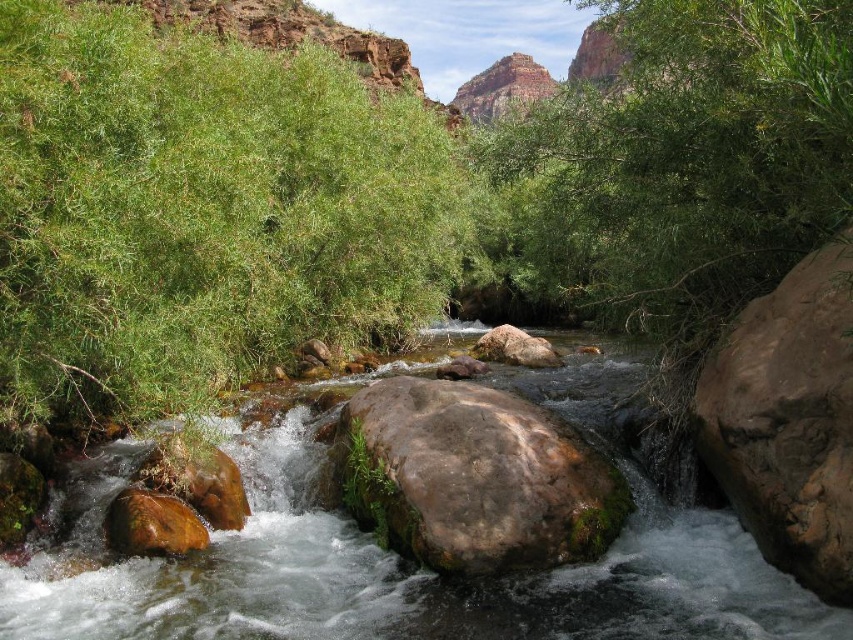
Which is below, green mossy rock at center or brown rough rock at right?

green mossy rock at center is lower down.

From the picture: Is green mossy rock at center positioned before brown rough rock at right?

That is False.

Image resolution: width=853 pixels, height=640 pixels. I want to click on green mossy rock at center, so tap(474, 477).

I want to click on green mossy rock at center, so click(x=474, y=477).

Can you confirm if green leafy shrubs at left is smaller than green mossy rock at center?

Incorrect, green leafy shrubs at left is not smaller in size than green mossy rock at center.

Who is taller, green leafy shrubs at left or green mossy rock at center?

Standing taller between the two is green leafy shrubs at left.

Does point (305, 220) come farther from viewer compared to point (465, 568)?

Yes, point (305, 220) is farther from viewer.

Image resolution: width=853 pixels, height=640 pixels. Find the location of `green leafy shrubs at left`. green leafy shrubs at left is located at coordinates click(x=199, y=211).

Is green mossy rock at center wider than brown rough rock at center?

Yes.

Which of these two, green mossy rock at center or brown rough rock at center, stands taller?

With more height is green mossy rock at center.

Does point (538, 541) come farther from viewer compared to point (511, 326)?

No, it is in front of (511, 326).

Where is `green mossy rock at center`? The image size is (853, 640). green mossy rock at center is located at coordinates (474, 477).